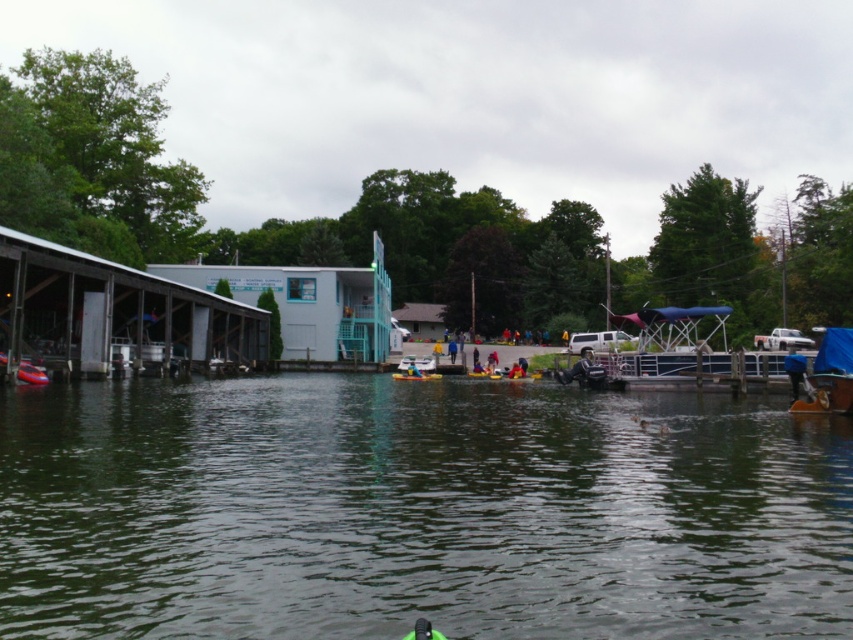
Question: Among these objects, which one is nearest to the camera?

Choices:
 (A) yellow fabric kayak at center
 (B) green water at center
 (C) orange plastic canoe at center

Answer: (B)

Question: Which point is closer to the camera taking this photo?

Choices:
 (A) pyautogui.click(x=425, y=372)
 (B) pyautogui.click(x=409, y=368)

Answer: (B)

Question: Where is blue tarpaulin boat at lower right located in relation to green fabric kayak at lower center in the image?

Choices:
 (A) above
 (B) below

Answer: (A)

Question: Is orange plastic canoe at center above yellow fabric kayak at center?

Choices:
 (A) no
 (B) yes

Answer: (A)

Question: Can you confirm if white wooden dock at left is wider than orange plastic canoe at center?

Choices:
 (A) no
 (B) yes

Answer: (B)

Question: Which point is farther to the camera?

Choices:
 (A) white wooden dock at left
 (B) yellow fabric kayak at center

Answer: (B)